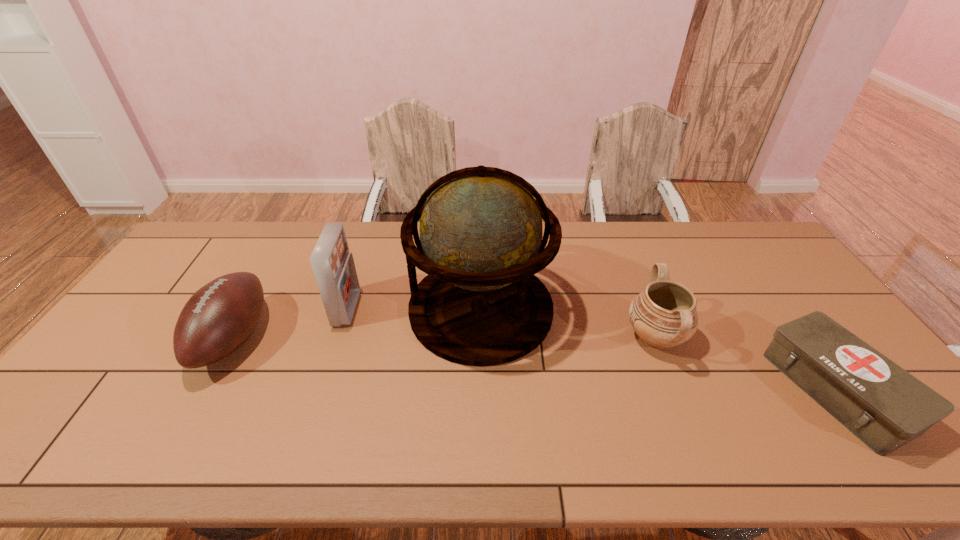
I want to click on globe, so click(x=481, y=244).

I want to click on the third object from left to right, so pos(481,244).

Locate an element on the screen. Image resolution: width=960 pixels, height=540 pixels. the taller first-aid kit is located at coordinates (333, 265).

Find the location of a particular element. the farther first-aid kit is located at coordinates (333, 265).

This screenshot has height=540, width=960. Find the location of `the fourth object from left to right`. the fourth object from left to right is located at coordinates (663, 315).

At what (x,y) coordinates should I click in order to perform the action: click on football (American). Please return your answer as a coordinate pair (x, y). Image resolution: width=960 pixels, height=540 pixels. Looking at the image, I should click on tap(218, 318).

Locate an element on the screen. The width and height of the screenshot is (960, 540). the shortest object is located at coordinates pos(883,405).

Locate an element on the screen. the rightmost object is located at coordinates (883, 405).

You are a GUI agent. You are given a task and a screenshot of the screen. Output one action in this format:
    pyautogui.click(x=<x>, y=<y>)
    Task: Click on the vacant space located on the front-facing side of the globe
    This screenshot has height=540, width=960.
    Given the screenshot: What is the action you would take?
    pyautogui.click(x=326, y=309)

The height and width of the screenshot is (540, 960). Identify the location of vacant space situated 0.330m on the front-facing side of the globe. click(300, 309).